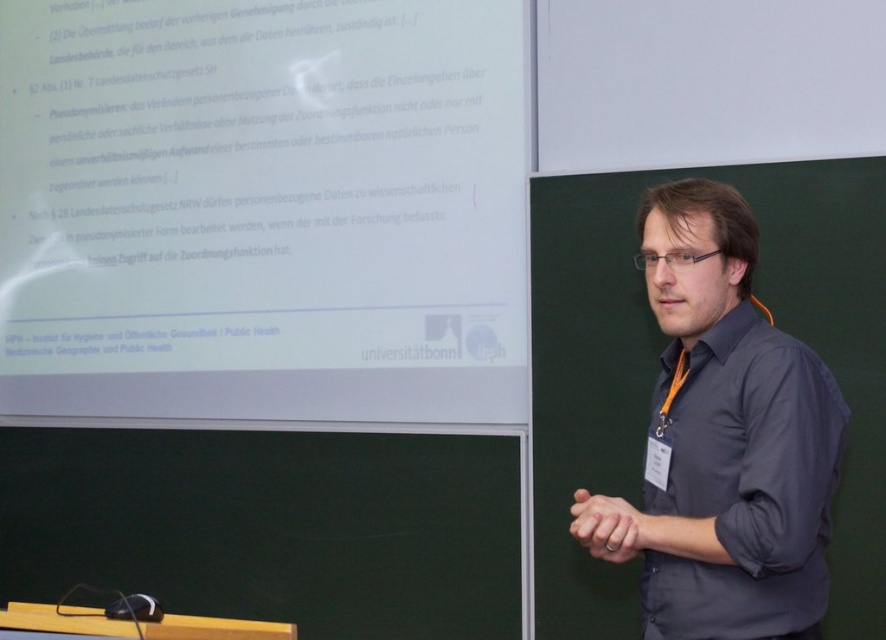
You are a student in the classroom and need to refer to the white paper at upper center during the presentation. Where exactly should you look on the chalkboard to find it?

The white paper at upper center is located at the coordinates point [263,209] on the chalkboard.

You are a student in the classroom. You need to look at the white paper at upper center and the dark gray shirt at center. Which object is higher up in the image?

The white paper at upper center is higher up in the image than the dark gray shirt at center.

You are a student sitting in the classroom. You want to look at the white paper at upper center and the dark gray shirt at center. Which object is closer to you?

The white paper at upper center is closer to you because it is further to the viewer than the dark gray shirt at center.